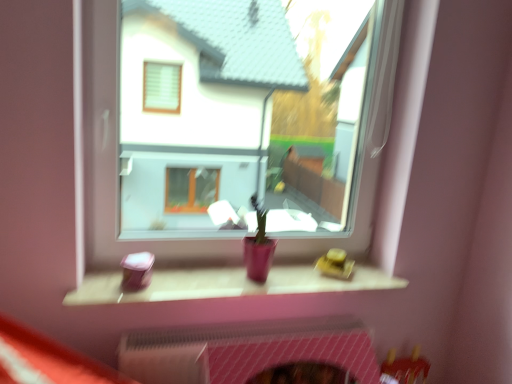
This screenshot has height=384, width=512. I want to click on pink mesh fireplace at lower center, so click(246, 350).

Does point (190, 270) lie in front of point (136, 361)?

No, (190, 270) is further to viewer.

Choose the correct answer: Is matte pink wood at center inside pink mesh fireplace at lower center or outside it?

matte pink wood at center exists outside the volume of pink mesh fireplace at lower center.

Is matte pink wood at center positioned with its back to pink mesh fireplace at lower center?

No.

What's the angular difference between matte pink wood at center and pink mesh fireplace at lower center's facing directions?

The angle between the facing direction of matte pink wood at center and the facing direction of pink mesh fireplace at lower center is 0.465 degrees.

Looking at this image, is matte pink wood at center far away from transparent glass window at center?

Indeed, matte pink wood at center is not near transparent glass window at center.

Between matte pink wood at center and transparent glass window at center, which one appears on the right side from the viewer's perspective?

transparent glass window at center.

Does matte pink wood at center have a larger size compared to transparent glass window at center?

No.

Is pink mesh fireplace at lower center positioned far away from matte pink wood at center?

No, pink mesh fireplace at lower center is not far from matte pink wood at center.

Considering the positions of objects pink mesh fireplace at lower center and matte pink wood at center in the image provided, who is more to the left, pink mesh fireplace at lower center or matte pink wood at center?

From the viewer's perspective, matte pink wood at center appears more on the left side.

Is pink mesh fireplace at lower center not inside matte pink wood at center?

Yes.

Considering the points (167, 369) and (190, 275), which point is in front, point (167, 369) or point (190, 275)?

The point (167, 369) is closer.

From a real-world perspective, between pink mesh fireplace at lower center and transparent glass window at center, who is vertically higher?

transparent glass window at center.

Does pink mesh fireplace at lower center come in front of transparent glass window at center?

No, it is behind transparent glass window at center.

How much distance is there between pink mesh fireplace at lower center and transparent glass window at center?

They are 2.05 meters apart.

What's the angular difference between pink mesh fireplace at lower center and transparent glass window at center's facing directions?

There is a 0.821-degree angle between the facing directions of pink mesh fireplace at lower center and transparent glass window at center.

Is transparent glass window at center at the right side of matte pink wood at center?

Yes.

Which of these two, transparent glass window at center or matte pink wood at center, is bigger?

Bigger between the two is transparent glass window at center.

How many degrees apart are the facing directions of transparent glass window at center and matte pink wood at center?

0.356 degrees separate the facing orientations of transparent glass window at center and matte pink wood at center.

Looking at this image, which is behind, transparent glass window at center or matte pink wood at center?

matte pink wood at center.

From the image's perspective, would you say transparent glass window at center is shown under pink mesh fireplace at lower center?

No, from the image's perspective, transparent glass window at center is not beneath pink mesh fireplace at lower center.

In the image, is transparent glass window at center positioned in front of or behind pink mesh fireplace at lower center?

transparent glass window at center is in front of pink mesh fireplace at lower center.

Can you tell me how much transparent glass window at center and pink mesh fireplace at lower center differ in facing direction?

The angular difference between transparent glass window at center and pink mesh fireplace at lower center is 0.821 degrees.

Is transparent glass window at center looking in the opposite direction of pink mesh fireplace at lower center?

transparent glass window at center is not turned away from pink mesh fireplace at lower center.

Where is `fireplace directly beneath the matte pink wood at center (from a real-world perspective)`? Image resolution: width=512 pixels, height=384 pixels. fireplace directly beneath the matte pink wood at center (from a real-world perspective) is located at coordinates (246, 350).

Where is `window above the matte pink wood at center (from the image's perspective)`? window above the matte pink wood at center (from the image's perspective) is located at coordinates (229, 146).

Estimate the real-world distances between objects in this image. Which object is further from matte pink wood at center, transparent glass window at center or pink mesh fireplace at lower center?

transparent glass window at center.

Estimate the real-world distances between objects in this image. Which object is closer to transparent glass window at center, matte pink wood at center or pink mesh fireplace at lower center?

matte pink wood at center lies closer to transparent glass window at center than the other object.

Based on their spatial positions, is transparent glass window at center or matte pink wood at center closer to pink mesh fireplace at lower center?

The object closer to pink mesh fireplace at lower center is matte pink wood at center.

Considering their positions, is pink mesh fireplace at lower center positioned closer to transparent glass window at center than matte pink wood at center?

matte pink wood at center is positioned closer to the anchor transparent glass window at center.

Estimate the real-world distances between objects in this image. Which object is closer to pink mesh fireplace at lower center, matte pink wood at center or transparent glass window at center?

Based on the image, matte pink wood at center appears to be nearer to pink mesh fireplace at lower center.

From the image, which object appears to be farther from matte pink wood at center, pink mesh fireplace at lower center or transparent glass window at center?

transparent glass window at center lies further to matte pink wood at center than the other object.

You are a GUI agent. You are given a task and a screenshot of the screen. Output one action in this format:
    pyautogui.click(x=<x>, y=<y>)
    Task: Click on the window sill between transparent glass window at center and pink mesh fireplace at lower center in the vertical direction
    The width and height of the screenshot is (512, 384).
    Given the screenshot: What is the action you would take?
    225,284